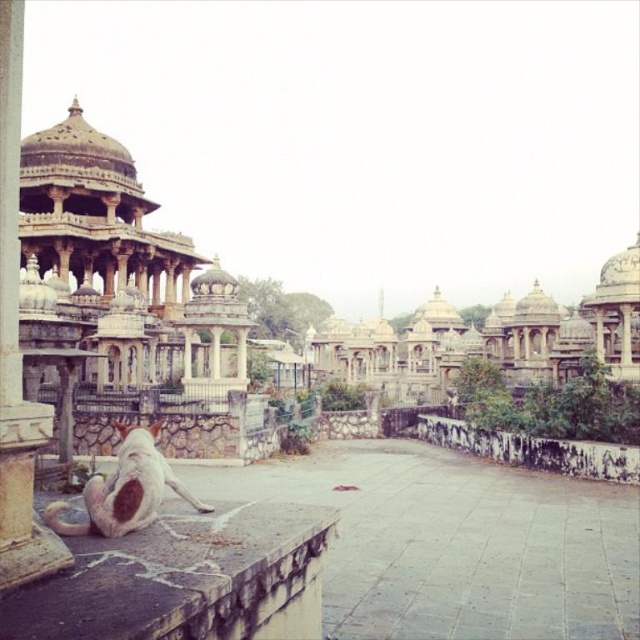
Based on the coordinates provided, which object in the scene is located at point (124, 273)?

The point (124, 273) corresponds to the white stone palace at left.

You are a tourist visiting the temple complex and want to take a photo of the white stone palace at left and the polished stone pillar at left. Which one should you focus on first if you want to capture both in the same frame?

The white stone palace at left is positioned on the left side of the polished stone pillar at left, so you should focus on the white stone palace at left first to ensure both are in the same frame.

You are a tourist visiting this historical site and want to sit down to rest. You see the gray stone ledge at lower left and the white stone palaces at center. Which one would be more suitable for sitting comfortably?

The white stone palaces at center are thicker than the gray stone ledge at lower left, so they would provide a more stable and comfortable seating area for resting.